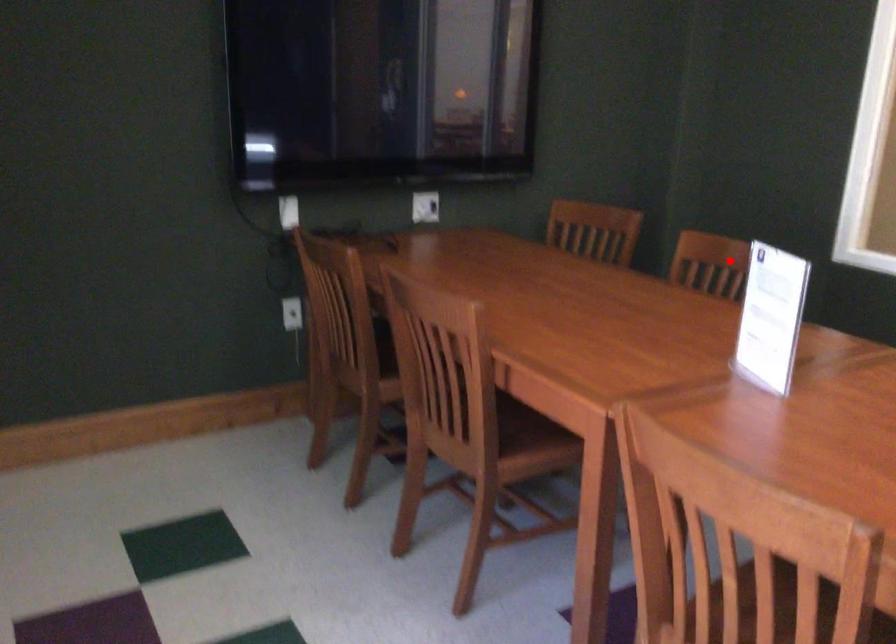
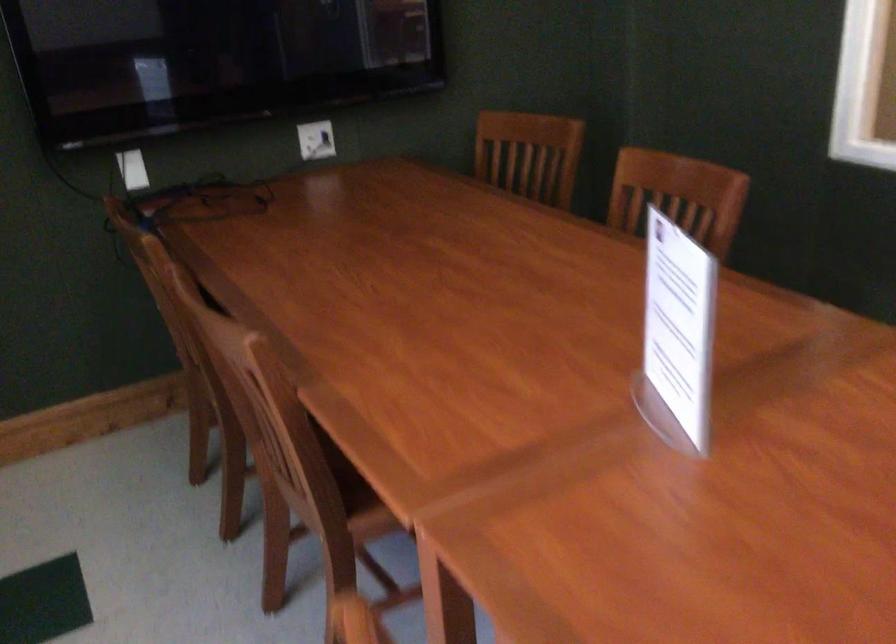
Question: I am providing you with two images of the same scene from different viewpoints. A red point is shown in image1. For the corresponding object point in image2, is it positioned nearer or farther from the camera?

Choices:
 (A) Nearer
 (B) Farther

Answer: (A)